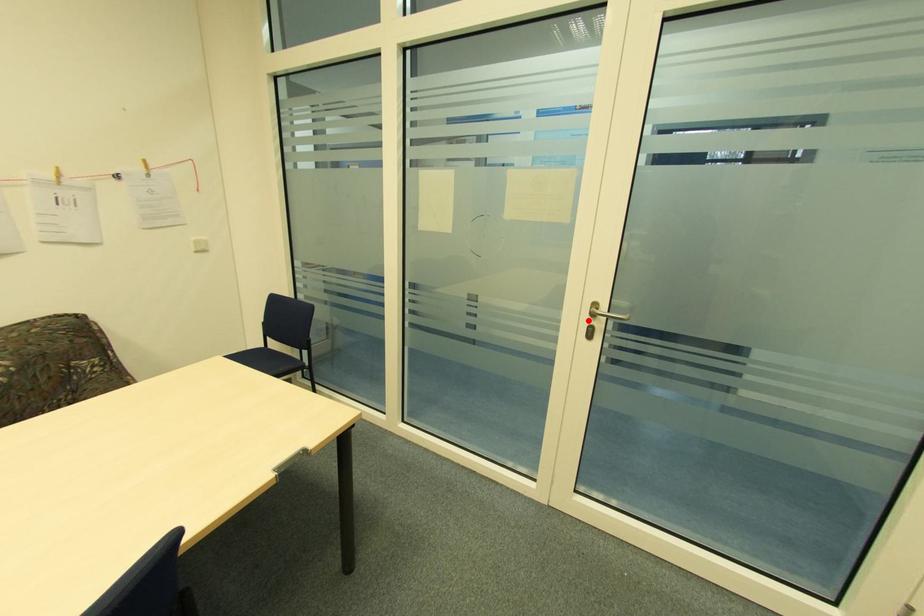
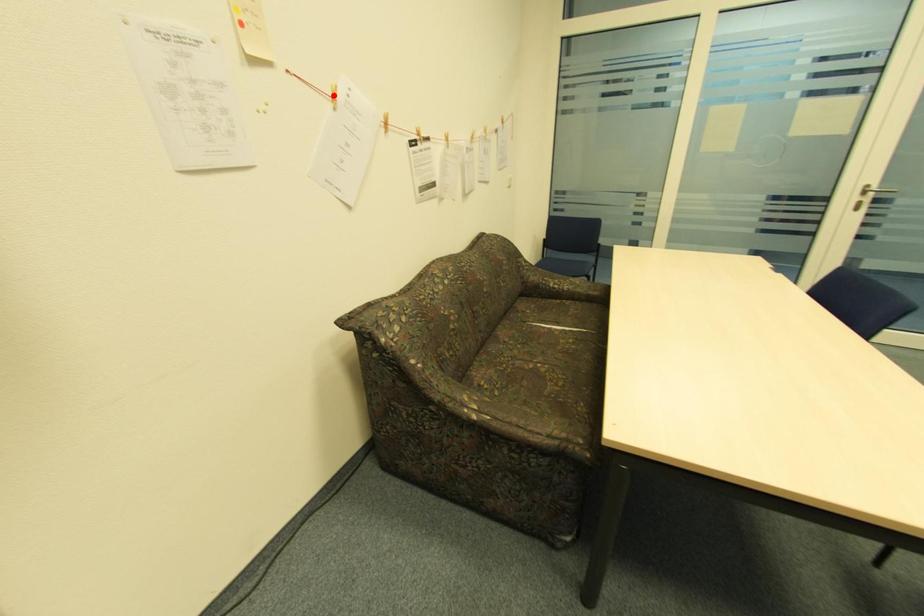
I am providing you with two images of the same scene from different viewpoints. A red point is marked on the first image and another point is marked on the second image. Do the highlighted points in image1 and image2 indicate the same real-world spot?

No